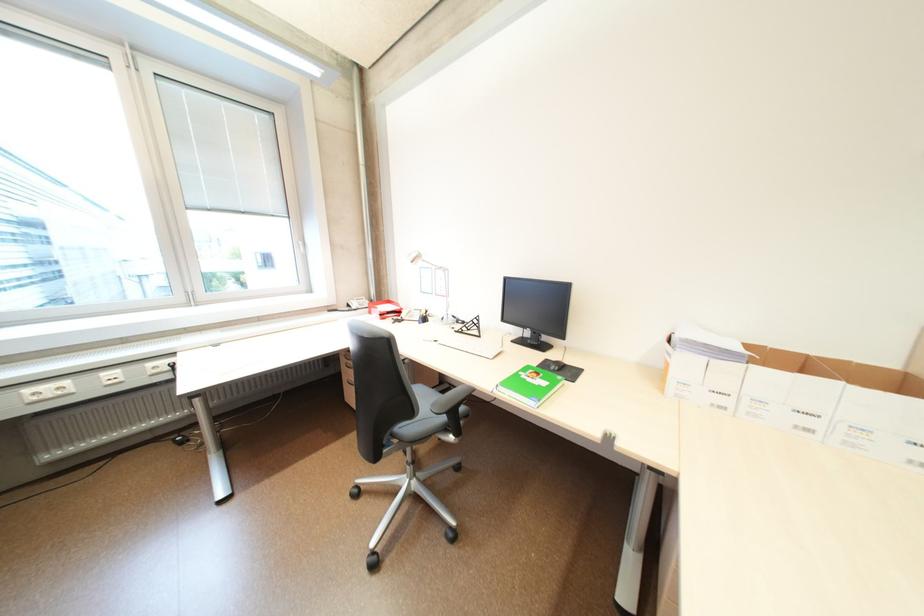
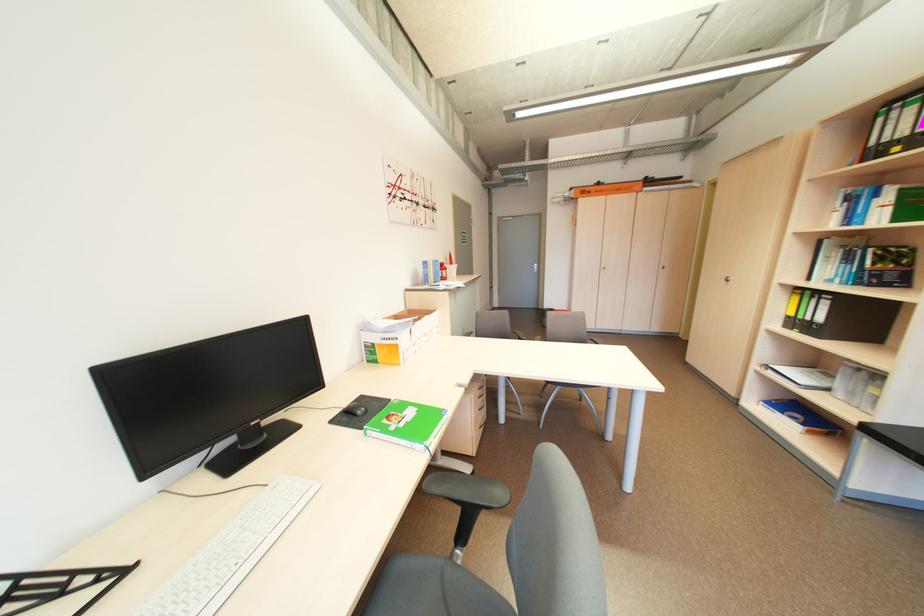
Find the pixel in the second image that matches pixel 676 365 in the first image.

(406, 347)